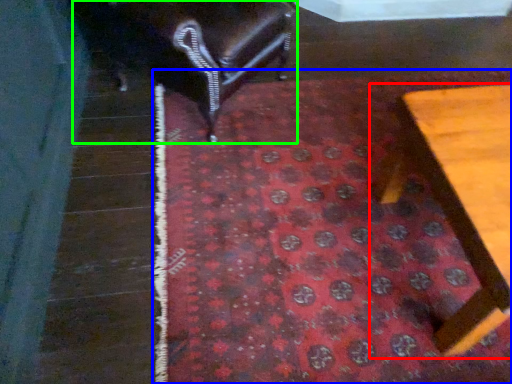
Question: Based on their relative distances, which object is nearer to furniture (highlighted by a red box)? Choose from mat (highlighted by a blue box) and furniture (highlighted by a green box).

Choices:
 (A) mat
 (B) furniture

Answer: (A)